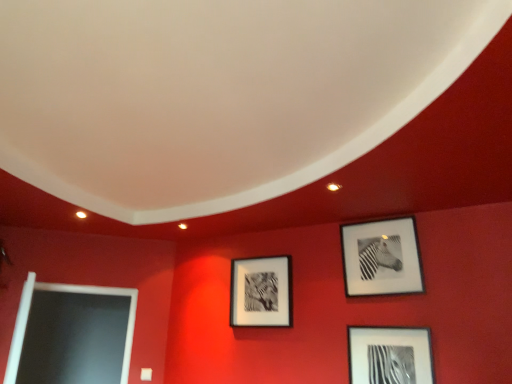
What do you see at coordinates (261, 292) in the screenshot? I see `matte black picture frame at center, the first picture frame viewed from the left` at bounding box center [261, 292].

Locate an element on the screen. metallic silver frame at lower right, which is the 2th picture frame in left-to-right order is located at coordinates (390, 355).

Identify the location of matte black picture frame at center, which is the 3th picture frame from right to left. (261, 292).

Is point (241, 281) positioned in front of point (424, 382)?

That is False.

From a real-world perspective, who is located lower, matte black picture frame at center, the first picture frame viewed from the left, or metallic silver frame at lower right, which is the 2th picture frame in left-to-right order?

From a 3D spatial view, metallic silver frame at lower right, which is the 2th picture frame in left-to-right order, is below.

Is matte black picture frame at center, the first picture frame viewed from the left, in contact with metallic silver frame at lower right, which is the 2th picture frame in left-to-right order?

matte black picture frame at center, the first picture frame viewed from the left, and metallic silver frame at lower right, which is the 2th picture frame in left-to-right order, are clearly separated.

Is matte black picture frame at center, the first picture frame viewed from the left, surrounded by metallic silver frame at lower right, which is the 2th picture frame in left-to-right order?

That's incorrect, matte black picture frame at center, the first picture frame viewed from the left, is not inside metallic silver frame at lower right, which is the 2th picture frame in left-to-right order.

Who is bigger, metallic silver frame at lower right, which is the 2th picture frame in left-to-right order, or matte black picture frame at center, the first picture frame viewed from the left?

matte black picture frame at center, the first picture frame viewed from the left.

From the image's perspective, is metallic silver frame at lower right, which is the 2th picture frame in left-to-right order, positioned above or below matte black picture frame at center, the first picture frame viewed from the left?

From the image's perspective, metallic silver frame at lower right, which is the 2th picture frame in left-to-right order, appears below matte black picture frame at center, the first picture frame viewed from the left.

From a real-world perspective, is metallic silver frame at lower right, which is the 2th picture frame in left-to-right order, physically located above or below matte black picture frame at center, which is the 3th picture frame from right to left?

metallic silver frame at lower right, which is the 2th picture frame in left-to-right order, is situated lower than matte black picture frame at center, which is the 3th picture frame from right to left, in the real world.

Is metallic silver frame at lower right, which is the second picture frame from right to left, beside black matte picture frame at upper right, positioned as the first picture frame in right-to-left order?

No.

From a real-world perspective, is metallic silver frame at lower right, which is the second picture frame from right to left, positioned over black matte picture frame at upper right, the 3th picture frame in the left-to-right sequence, based on gravity?

Incorrect, from a real-world perspective, metallic silver frame at lower right, which is the second picture frame from right to left, is lower than black matte picture frame at upper right, the 3th picture frame in the left-to-right sequence.

Which of these two, metallic silver frame at lower right, which is the 2th picture frame in left-to-right order, or black matte picture frame at upper right, positioned as the first picture frame in right-to-left order, is thinner?

black matte picture frame at upper right, positioned as the first picture frame in right-to-left order.

The height and width of the screenshot is (384, 512). There is a black matte picture frame at upper right, positioned as the first picture frame in right-to-left order. In order to click on the 1st picture frame below it (from a real-world perspective) in this screenshot , I will do `click(261, 292)`.

Is matte black picture frame at center, which is the 3th picture frame from right to left, oriented towards black matte picture frame at upper right, the 3th picture frame in the left-to-right sequence?

No, matte black picture frame at center, which is the 3th picture frame from right to left, does not turn towards black matte picture frame at upper right, the 3th picture frame in the left-to-right sequence.

Is matte black picture frame at center, the first picture frame viewed from the left, not close to black matte picture frame at upper right, positioned as the first picture frame in right-to-left order?

No, matte black picture frame at center, the first picture frame viewed from the left, is not far away from black matte picture frame at upper right, positioned as the first picture frame in right-to-left order.

Considering the sizes of objects black matte picture frame at upper right, positioned as the first picture frame in right-to-left order, and metallic silver frame at lower right, which is the 2th picture frame in left-to-right order, in the image provided, who is taller, black matte picture frame at upper right, positioned as the first picture frame in right-to-left order, or metallic silver frame at lower right, which is the 2th picture frame in left-to-right order,?

black matte picture frame at upper right, positioned as the first picture frame in right-to-left order, is taller.

Can you confirm if black matte picture frame at upper right, positioned as the first picture frame in right-to-left order, is wider than metallic silver frame at lower right, which is the 2th picture frame in left-to-right order?

In fact, black matte picture frame at upper right, positioned as the first picture frame in right-to-left order, might be narrower than metallic silver frame at lower right, which is the 2th picture frame in left-to-right order.

In terms of size, does black matte picture frame at upper right, positioned as the first picture frame in right-to-left order, appear bigger or smaller than metallic silver frame at lower right, which is the 2th picture frame in left-to-right order?

Clearly, black matte picture frame at upper right, positioned as the first picture frame in right-to-left order, is larger in size than metallic silver frame at lower right, which is the 2th picture frame in left-to-right order.

How many degrees apart are the facing directions of black matte picture frame at upper right, positioned as the first picture frame in right-to-left order, and metallic silver frame at lower right, which is the second picture frame from right to left?

The angular difference between black matte picture frame at upper right, positioned as the first picture frame in right-to-left order, and metallic silver frame at lower right, which is the second picture frame from right to left, is 0.0502 degrees.

Which is in front, black matte picture frame at upper right, the 3th picture frame in the left-to-right sequence, or matte black picture frame at center, the first picture frame viewed from the left?

black matte picture frame at upper right, the 3th picture frame in the left-to-right sequence, is closer to the camera.

Is black matte picture frame at upper right, positioned as the first picture frame in right-to-left order, not inside matte black picture frame at center, the first picture frame viewed from the left?

Result: That's correct, black matte picture frame at upper right, positioned as the first picture frame in right-to-left order, is outside of matte black picture frame at center, the first picture frame viewed from the left.

How much distance is there between black matte picture frame at upper right, the 3th picture frame in the left-to-right sequence, and matte black picture frame at center, the first picture frame viewed from the left?

They are 27.24 inches apart.

Considering the relative sizes of black matte picture frame at upper right, the 3th picture frame in the left-to-right sequence, and matte black picture frame at center, which is the 3th picture frame from right to left, in the image provided, is black matte picture frame at upper right, the 3th picture frame in the left-to-right sequence, shorter than matte black picture frame at center, which is the 3th picture frame from right to left,?

Incorrect, the height of black matte picture frame at upper right, the 3th picture frame in the left-to-right sequence, does not fall short of that of matte black picture frame at center, which is the 3th picture frame from right to left.

You are a GUI agent. You are given a task and a screenshot of the screen. Output one action in this format:
    pyautogui.click(x=<x>, y=<y>)
    Task: Click on the picture frame to the left of metallic silver frame at lower right, which is the 2th picture frame in left-to-right order
    
    Given the screenshot: What is the action you would take?
    click(261, 292)

Locate an element on the screen. picture frame that is the 2nd one when counting backward from the metallic silver frame at lower right, which is the 2th picture frame in left-to-right order is located at coordinates (261, 292).

Looking at the image, which one is located further to metallic silver frame at lower right, which is the second picture frame from right to left, matte black picture frame at center, the first picture frame viewed from the left, or black matte picture frame at upper right, the 3th picture frame in the left-to-right sequence?

The object further to metallic silver frame at lower right, which is the second picture frame from right to left, is matte black picture frame at center, the first picture frame viewed from the left.

In the scene shown: Which object lies further to the anchor point black matte picture frame at upper right, positioned as the first picture frame in right-to-left order, metallic silver frame at lower right, which is the 2th picture frame in left-to-right order, or matte black picture frame at center, which is the 3th picture frame from right to left?

matte black picture frame at center, which is the 3th picture frame from right to left, lies further to black matte picture frame at upper right, positioned as the first picture frame in right-to-left order, than the other object.

In the scene shown: Which object lies further to the anchor point metallic silver frame at lower right, which is the second picture frame from right to left, black matte picture frame at upper right, the 3th picture frame in the left-to-right sequence, or matte black picture frame at center, which is the 3th picture frame from right to left?

matte black picture frame at center, which is the 3th picture frame from right to left, is further to metallic silver frame at lower right, which is the second picture frame from right to left.

Based on the photo, based on their spatial positions, is metallic silver frame at lower right, which is the 2th picture frame in left-to-right order, or black matte picture frame at upper right, the 3th picture frame in the left-to-right sequence, closer to matte black picture frame at center, which is the 3th picture frame from right to left?

Based on the image, black matte picture frame at upper right, the 3th picture frame in the left-to-right sequence, appears to be nearer to matte black picture frame at center, which is the 3th picture frame from right to left.

Which object lies nearer to the anchor point matte black picture frame at center, the first picture frame viewed from the left, black matte picture frame at upper right, the 3th picture frame in the left-to-right sequence, or metallic silver frame at lower right, which is the second picture frame from right to left?

black matte picture frame at upper right, the 3th picture frame in the left-to-right sequence, is positioned closer to the anchor matte black picture frame at center, the first picture frame viewed from the left.

Based on their spatial positions, is matte black picture frame at center, which is the 3th picture frame from right to left, or metallic silver frame at lower right, which is the 2th picture frame in left-to-right order, further from black matte picture frame at upper right, positioned as the first picture frame in right-to-left order?

matte black picture frame at center, which is the 3th picture frame from right to left, is further to black matte picture frame at upper right, positioned as the first picture frame in right-to-left order.

Identify the location of picture frame situated between matte black picture frame at center, the first picture frame viewed from the left, and black matte picture frame at upper right, positioned as the first picture frame in right-to-left order, from left to right. The image size is (512, 384). (390, 355).